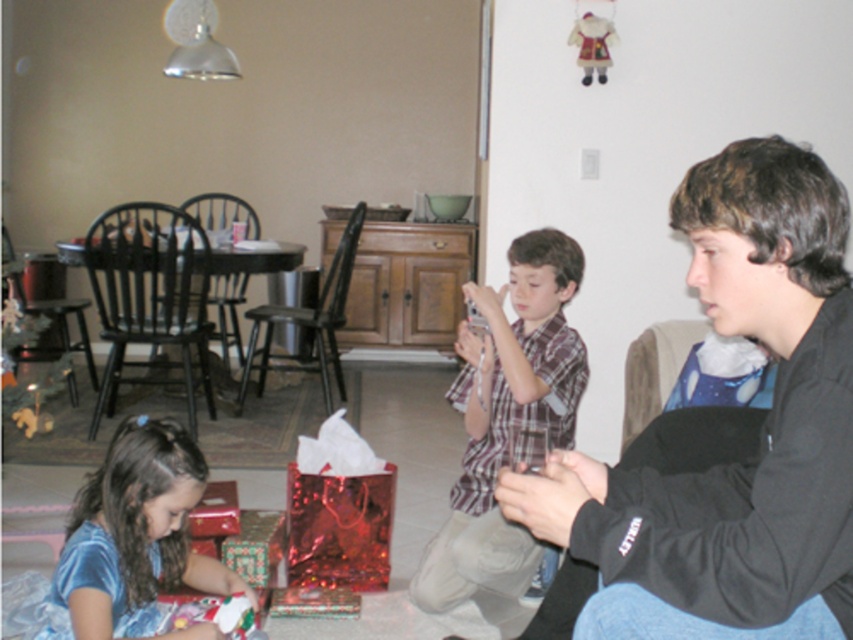
You are standing in the living room and want to find the shiny blue dress at lower left. According to the coordinates provided, where exactly should you look?

You should look at point 0.844 on the x axis and point 0.159 on the y axis to find the shiny blue dress at lower left.

You are a photographer setting up a camera to capture the scene. The shiny blue dress at lower left and the velvet plush santa at upper right are both in the frame. If you want to ensure both are fully visible without cropping, which object should you consider its width when adjusting the camera angle?

The shiny blue dress at lower left might be wider than the velvet plush santa at upper right, so you should consider the width of the shiny blue dress at lower left to ensure it fits in the frame.

You are a guest at this holiday gathering and want to place a gift between the black matte jacket at lower right and the velvet plush santa at upper right. How much space do you have to work with?

The black matte jacket at lower right and the velvet plush santa at upper right are 9.00 feet apart from each other, so you have 9.00 feet of space to place the gift between them.